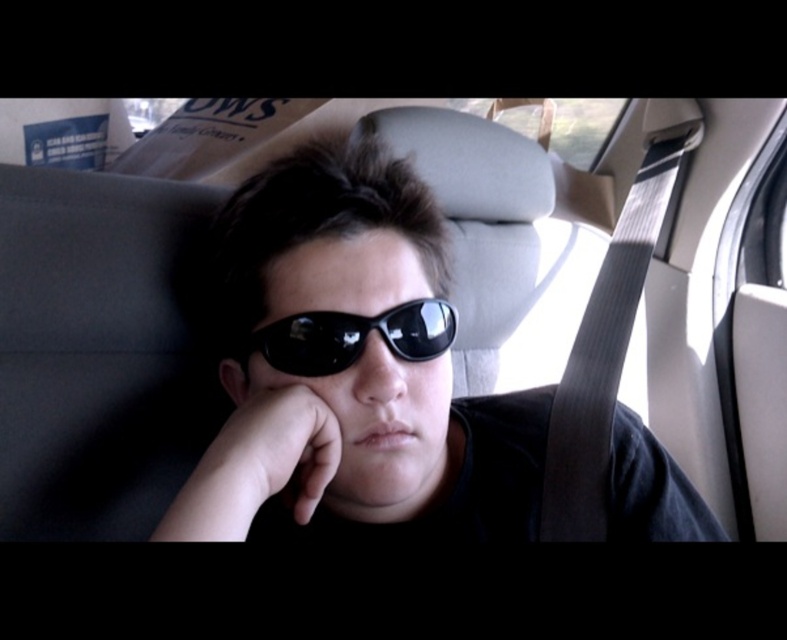
Is skinny flesh-toned hand at center smaller than black reflective sunglasses at center?

No.

Can you confirm if skinny flesh-toned hand at center is positioned below black reflective sunglasses at center?

Correct, skinny flesh-toned hand at center is located below black reflective sunglasses at center.

Who is more distant from viewer, [209,460] or [434,321]?

The point [434,321] is more distant.

The width and height of the screenshot is (787, 640). In order to click on skinny flesh-toned hand at center in this screenshot , I will do coord(257,467).

Does matte black sunglasses at center appear over skinny flesh-toned hand at center?

Yes.

Is matte black sunglasses at center thinner than skinny flesh-toned hand at center?

In fact, matte black sunglasses at center might be wider than skinny flesh-toned hand at center.

This screenshot has height=640, width=787. Describe the element at coordinates (91, 337) in the screenshot. I see `matte black sunglasses at center` at that location.

The width and height of the screenshot is (787, 640). Identify the location of matte black sunglasses at center. (91, 337).

Who is more distant from viewer, (680, 412) or (377, 330)?

The point (680, 412) is more distant.

Does matte black sunglasses at center have a greater width compared to black reflective sunglasses at center?

Yes.

Does point (619, 490) lie behind point (436, 314)?

Yes, point (619, 490) is behind point (436, 314).

You are a GUI agent. You are given a task and a screenshot of the screen. Output one action in this format:
    pyautogui.click(x=<x>, y=<y>)
    Task: Click on the matte black sunglasses at center
    
    Given the screenshot: What is the action you would take?
    pos(91,337)